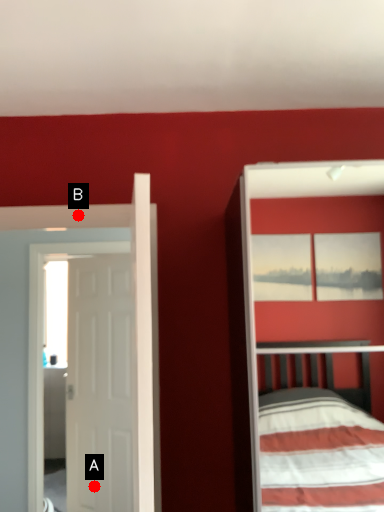
Question: Two points are circled on the image, labeled by A and B beside each circle. Which of the following is the closest to the observer?

Choices:
 (A) A is closer
 (B) B is closer

Answer: (B)